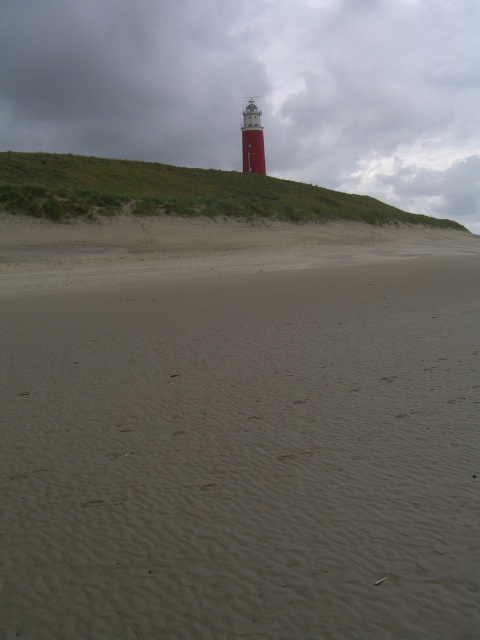
Can you confirm if smooth beige sand at center is smaller than green grassy hillside at upper center?

Correct, smooth beige sand at center occupies less space than green grassy hillside at upper center.

Can you confirm if smooth beige sand at center is positioned above green grassy hillside at upper center?

Incorrect, smooth beige sand at center is not positioned above green grassy hillside at upper center.

The height and width of the screenshot is (640, 480). What do you see at coordinates (238, 429) in the screenshot?
I see `smooth beige sand at center` at bounding box center [238, 429].

In order to click on smooth beige sand at center in this screenshot , I will do `click(238, 429)`.

Is smooth beige sand at center positioned behind smooth red lighthouse at center?

That is False.

Is smooth beige sand at center shorter than smooth red lighthouse at center?

Correct, smooth beige sand at center is not as tall as smooth red lighthouse at center.

Who is more forward, (344, 228) or (244, 145)?

Point (344, 228)

Where is `smooth beige sand at center`? This screenshot has width=480, height=640. smooth beige sand at center is located at coordinates (238, 429).

Which is more to the left, green grassy hillside at upper center or smooth red lighthouse at center?

smooth red lighthouse at center

Is point (172, 188) farther from viewer compared to point (255, 156)?

No, (172, 188) is closer to viewer.

What do you see at coordinates (177, 193) in the screenshot? This screenshot has width=480, height=640. I see `green grassy hillside at upper center` at bounding box center [177, 193].

At what (x,y) coordinates should I click in order to perform the action: click on green grassy hillside at upper center. Please return your answer as a coordinate pair (x, y). The image size is (480, 640). Looking at the image, I should click on [x=177, y=193].